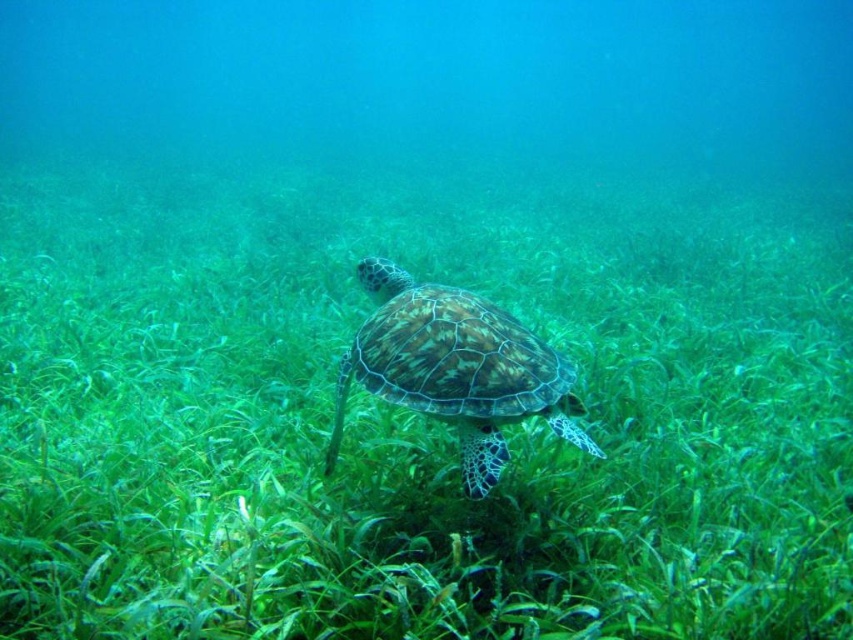
What do you see at coordinates (418, 417) in the screenshot?
I see `green leafy grass at center` at bounding box center [418, 417].

Is point (354, 257) positioned in front of point (532, 410)?

No, it is behind (532, 410).

You are a GUI agent. You are given a task and a screenshot of the screen. Output one action in this format:
    pyautogui.click(x=<x>, y=<y>)
    Task: Click on the green leafy grass at center
    
    Given the screenshot: What is the action you would take?
    pyautogui.click(x=418, y=417)